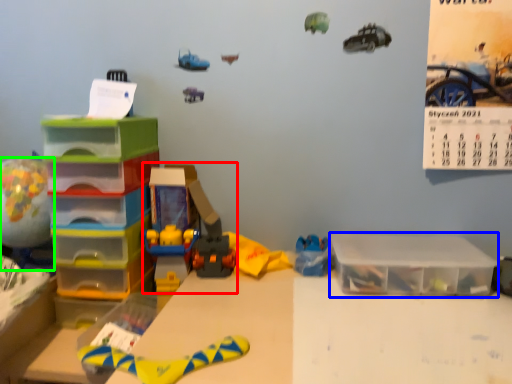
Question: Considering the real-world distances, which object is farthest from toy (highlighted by a red box)? storage box (highlighted by a blue box) or toy (highlighted by a green box)?

Choices:
 (A) storage box
 (B) toy

Answer: (A)